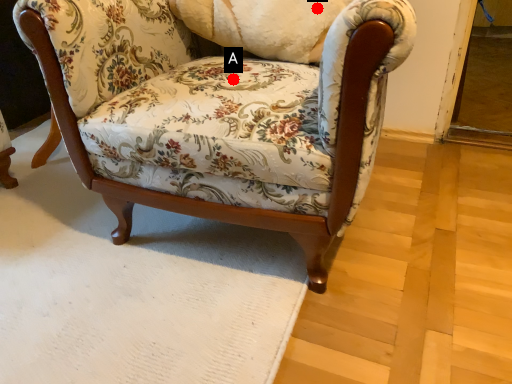
Question: Two points are circled on the image, labeled by A and B beside each circle. Among these points, which one is farthest from the camera?

Choices:
 (A) A is further
 (B) B is further

Answer: (B)